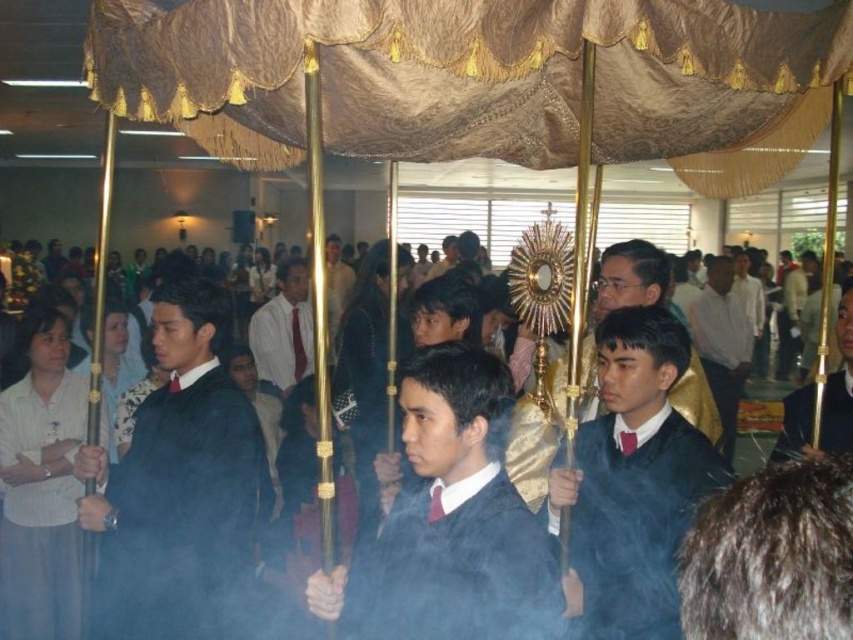
Between matte black robes at center and white matte robe at lower left, which one appears on the left side from the viewer's perspective?

white matte robe at lower left is more to the left.

What do you see at coordinates (630, 275) in the screenshot? The image size is (853, 640). I see `matte black robes at center` at bounding box center [630, 275].

The image size is (853, 640). I want to click on matte black robes at center, so click(630, 275).

Does black matte robe at center have a smaller size compared to white striped shirt at center?

Correct, black matte robe at center occupies less space than white striped shirt at center.

Does black matte robe at center appear on the left side of white striped shirt at center?

No, black matte robe at center is not to the left of white striped shirt at center.

Describe the element at coordinates (183, 515) in the screenshot. The width and height of the screenshot is (853, 640). I see `black matte robe at center` at that location.

Where is `black matte robe at center`? This screenshot has width=853, height=640. black matte robe at center is located at coordinates (183, 515).

Who is positioned more to the left, dark blue velvet robe at center or white matte robe at lower left?

From the viewer's perspective, white matte robe at lower left appears more on the left side.

Is dark blue velvet robe at center to the right of white matte robe at lower left from the viewer's perspective?

Indeed, dark blue velvet robe at center is positioned on the right side of white matte robe at lower left.

Which is in front, point (593, 580) or point (47, 557)?

Point (593, 580) is in front.

I want to click on dark blue velvet robe at center, so click(636, 522).